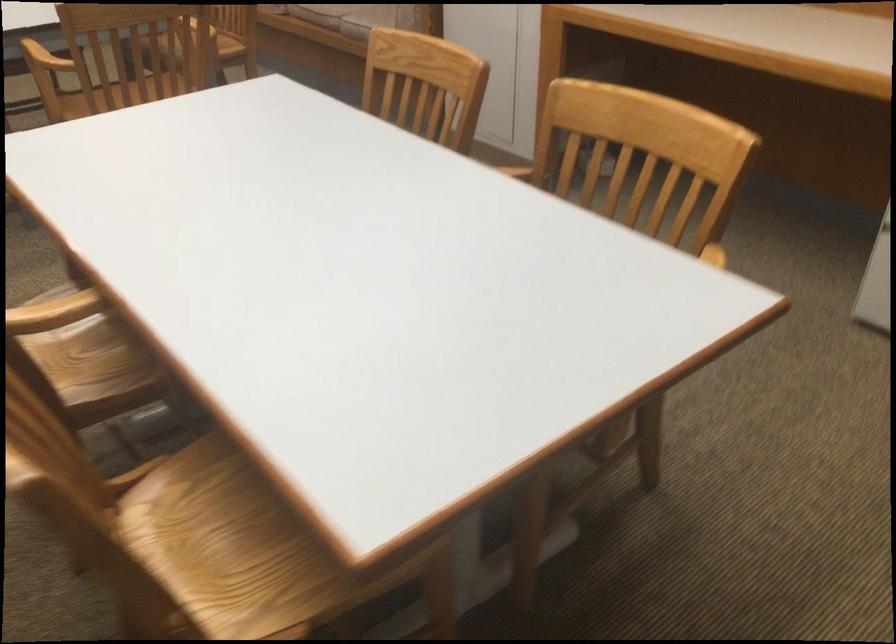
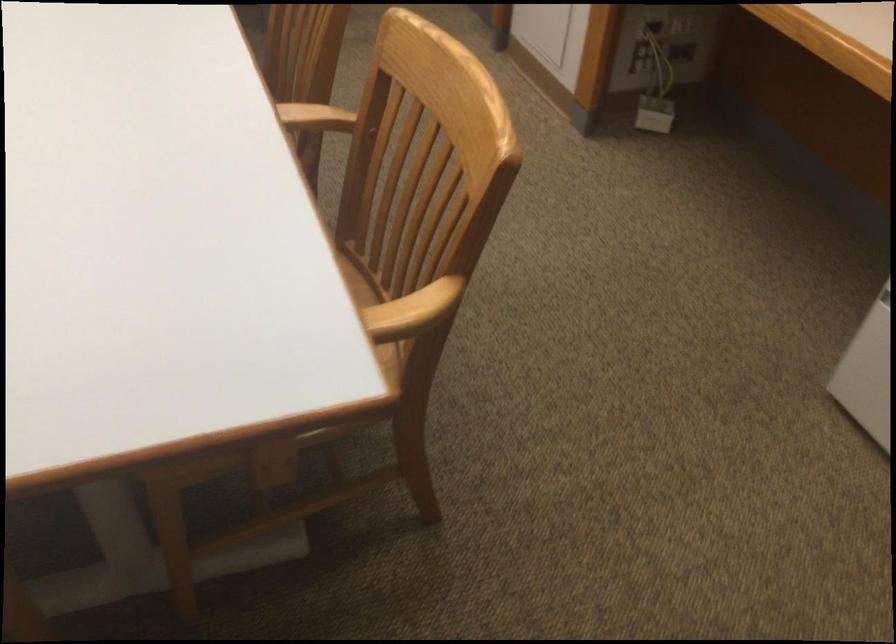
Question: How did the camera likely rotate?

Choices:
 (A) Left
 (B) Right
 (C) Up
 (D) Down

Answer: (A)